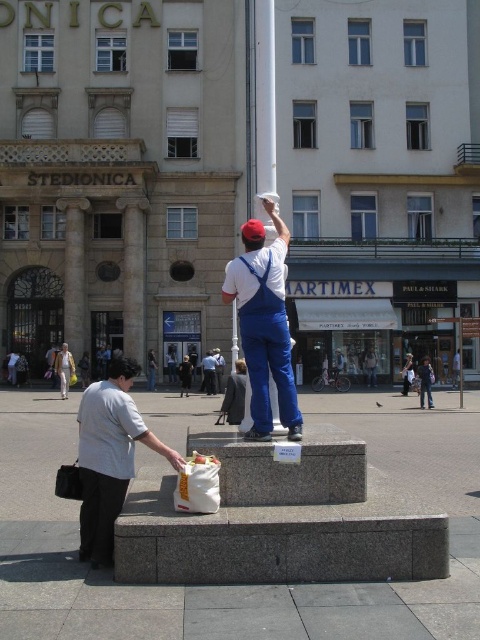
Question: Estimate the real-world distances between objects in this image. Which object is farther from the white fabric bag at lower left?

Choices:
 (A) denim jacket at lower right
 (B) white cotton shirt at center

Answer: (A)

Question: Which object is closer to the camera taking this photo?

Choices:
 (A) denim jacket at lower right
 (B) white fabric bag at lower left
 (C) white cotton shirt at center

Answer: (B)

Question: Can you confirm if white cotton shirt at center is positioned above denim jacket at lower right?

Choices:
 (A) yes
 (B) no

Answer: (A)

Question: Is white fabric bag at lower left below denim jacket at lower right?

Choices:
 (A) no
 (B) yes

Answer: (A)

Question: Among these objects, which one is nearest to the camera?

Choices:
 (A) white fabric bag at lower left
 (B) denim jacket at lower right

Answer: (A)

Question: Considering the relative positions of white cotton shirt at center and denim jacket at lower right in the image provided, where is white cotton shirt at center located with respect to denim jacket at lower right?

Choices:
 (A) right
 (B) left

Answer: (B)